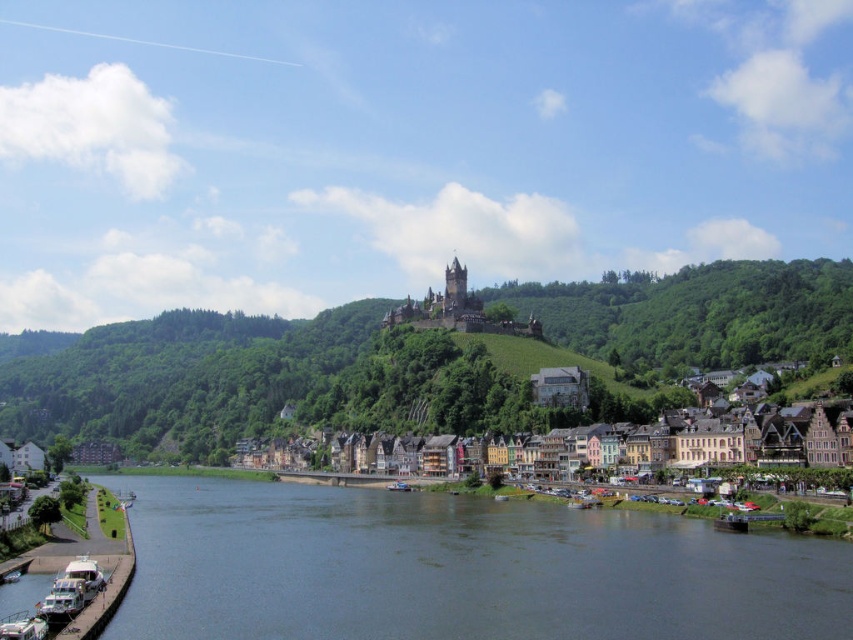
Can you confirm if dark blue water at lower center is taller than multicolored stone buildings at center?

In fact, dark blue water at lower center may be shorter than multicolored stone buildings at center.

Which is in front, point (791, 579) or point (686, 451)?

Point (791, 579) is in front.

Is point (228, 563) farther from viewer compared to point (518, 452)?

No.

The image size is (853, 640). Find the location of `dark blue water at lower center`. dark blue water at lower center is located at coordinates (457, 570).

In the scene shown: Which of these two, green leafy hillside at center or multicolored stone buildings at center, stands shorter?

With less height is multicolored stone buildings at center.

Is green leafy hillside at center to the left of multicolored stone buildings at center from the viewer's perspective?

Indeed, green leafy hillside at center is positioned on the left side of multicolored stone buildings at center.

Between point (224, 362) and point (397, 456), which one is positioned in front?

Point (397, 456) is in front.

You are a GUI agent. You are given a task and a screenshot of the screen. Output one action in this format:
    pyautogui.click(x=<x>, y=<y>)
    Task: Click on the green leafy hillside at center
    
    Given the screenshot: What is the action you would take?
    pyautogui.click(x=415, y=358)

Does point (820, 625) lie in front of point (233, 352)?

Yes, it is.

Is point (640, 572) closer to camera compared to point (20, 371)?

Yes, it is.

This screenshot has height=640, width=853. I want to click on dark blue water at lower center, so click(457, 570).